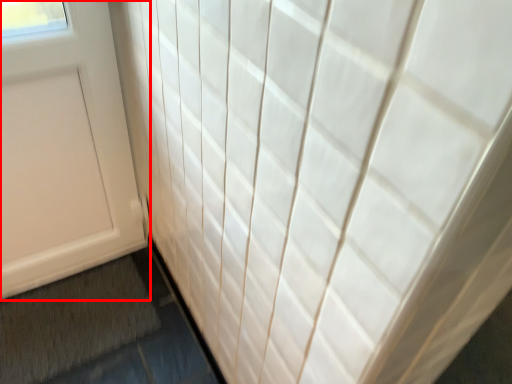
Question: From the image's perspective, where is door (annotated by the red box) located in relation to bath mat in the image?

Choices:
 (A) above
 (B) below

Answer: (A)